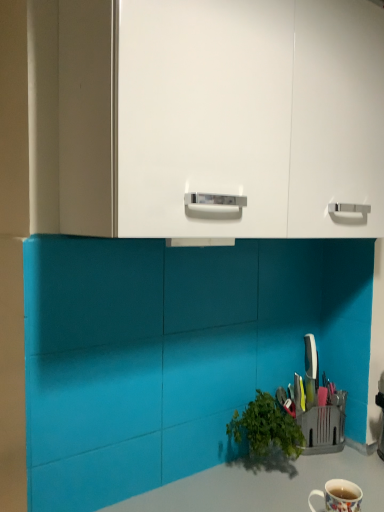
Locate an element on the screen. The image size is (384, 512). blank space situated above smooth gray countertop at lower center (from a real-world perspective) is located at coordinates (296, 475).